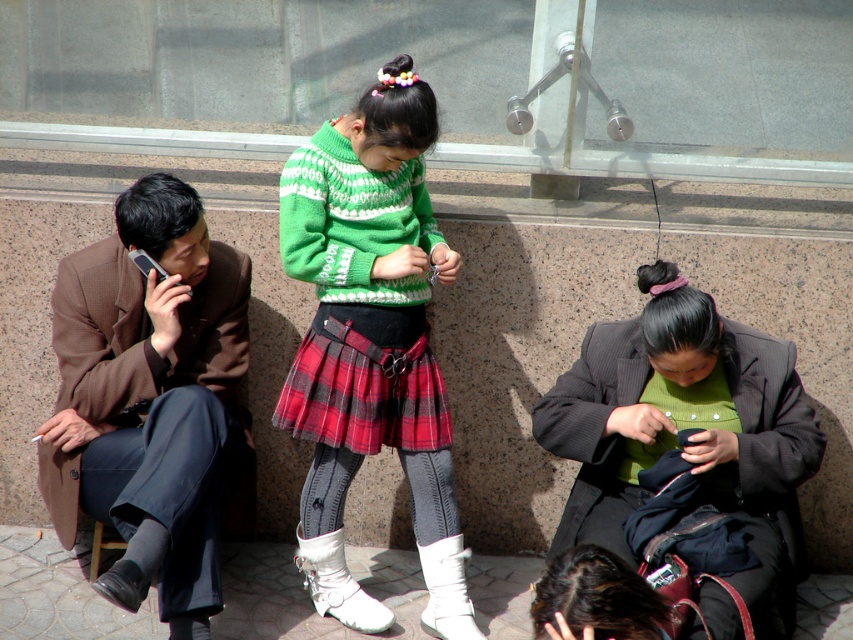
You are a photographer standing 4 meters away from the green knitted sweater at center. Can you capture the entire scene in one photo without moving?

The distance between the green knitted sweater at center and the viewer is 3.97 meters, which is just under 4 meters. Since the photographer is standing exactly 4 meters away, they can likely capture the entire scene in one photo without needing to move.

You are a delivery person who needs to hand a package to the recipient. You are currently standing 3.74 meters away from the brown woolen coat at left. Can you safely deliver the package without getting too close?

The brown woolen coat at left and the viewer are 3.74 meters apart. Since the distance is already maintained at 3.74 meters, you can safely deliver the package without needing to get closer.